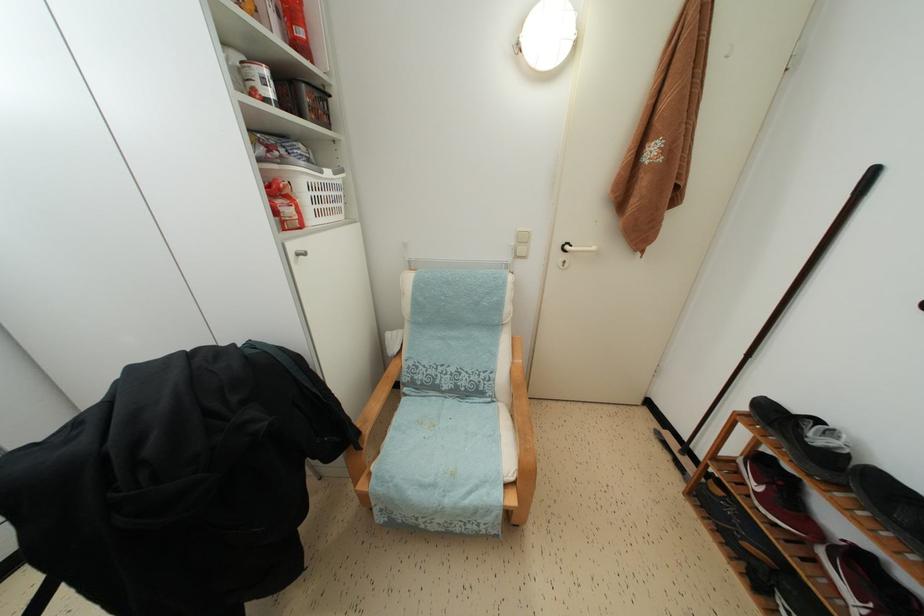
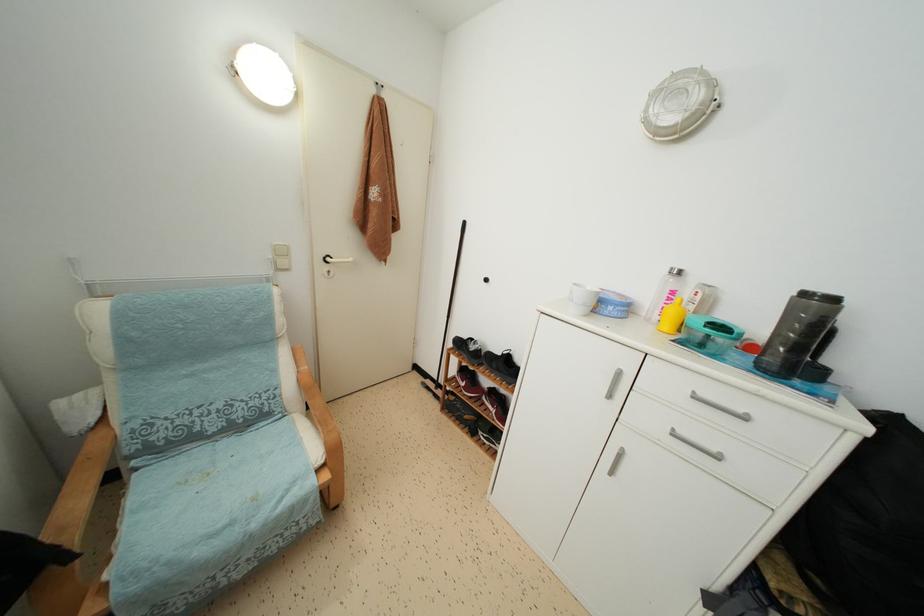
The point at (566, 252) is marked in the first image. Where is the corresponding point in the second image?

(329, 264)